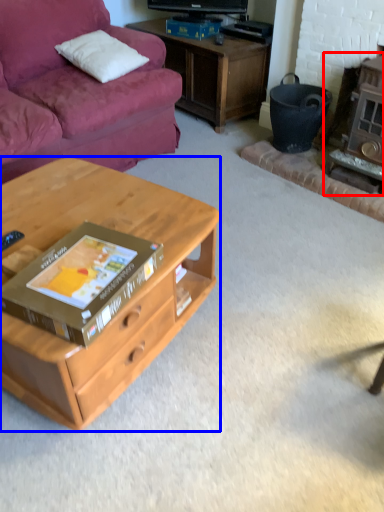
Question: Which of the following is the farthest to the observer, fireplace (highlighted by a red box) or desk (highlighted by a blue box)?

Choices:
 (A) fireplace
 (B) desk

Answer: (A)